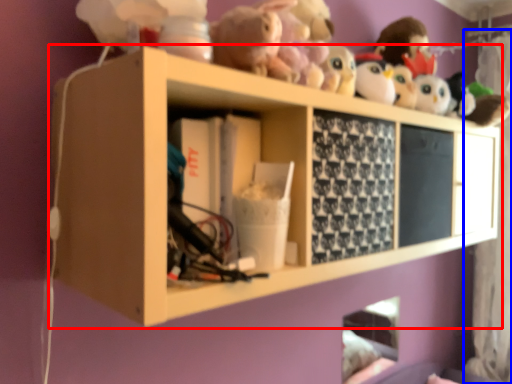
Question: Which point is further to the camera, shelf (highlighted by a red box) or curtain (highlighted by a blue box)?

Choices:
 (A) shelf
 (B) curtain

Answer: (B)